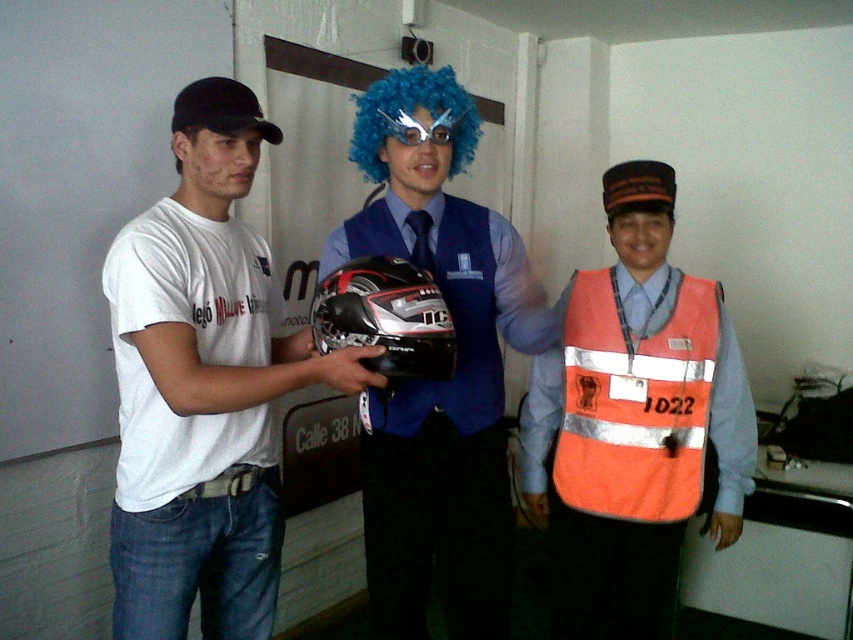
Can you confirm if orange reflective vest at center is thinner than shiny black helmet at center?

No.

Consider the image. Measure the distance between point (538, 490) and camera.

They are 6.81 feet apart.

Who is more distant from viewer, (x=567, y=630) or (x=467, y=349)?

Point (x=567, y=630)

This screenshot has width=853, height=640. I want to click on orange reflective vest at center, so click(633, 420).

Does orange reflective vest at center appear under glossy black helmet at center?

Yes, orange reflective vest at center is below glossy black helmet at center.

Can you confirm if orange reflective vest at center is bigger than glossy black helmet at center?

Yes, orange reflective vest at center is bigger than glossy black helmet at center.

Is point (627, 465) less distant than point (370, 291)?

That is False.

Identify the location of orange reflective vest at center. The image size is (853, 640). (633, 420).

Can you confirm if white matte t-shirt at left is taller than shiny black helmet at center?

No, white matte t-shirt at left is not taller than shiny black helmet at center.

Is white matte t-shirt at left to the left of shiny black helmet at center from the viewer's perspective?

Correct, you'll find white matte t-shirt at left to the left of shiny black helmet at center.

Find the location of `white matte t-shirt at left`. white matte t-shirt at left is located at coordinates (202, 387).

What are the coordinates of `white matte t-shirt at left` in the screenshot? It's located at (202, 387).